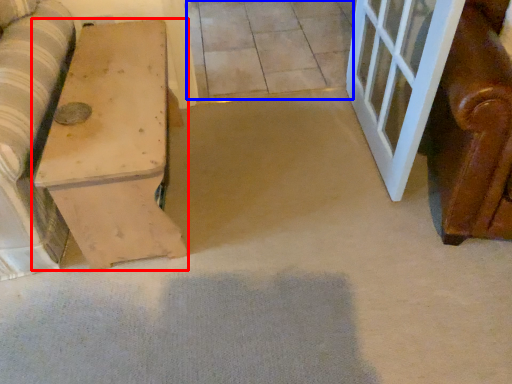
Question: Among these objects, which one is farthest to the camera, furniture (highlighted by a red box) or tile (highlighted by a blue box)?

Choices:
 (A) furniture
 (B) tile

Answer: (B)